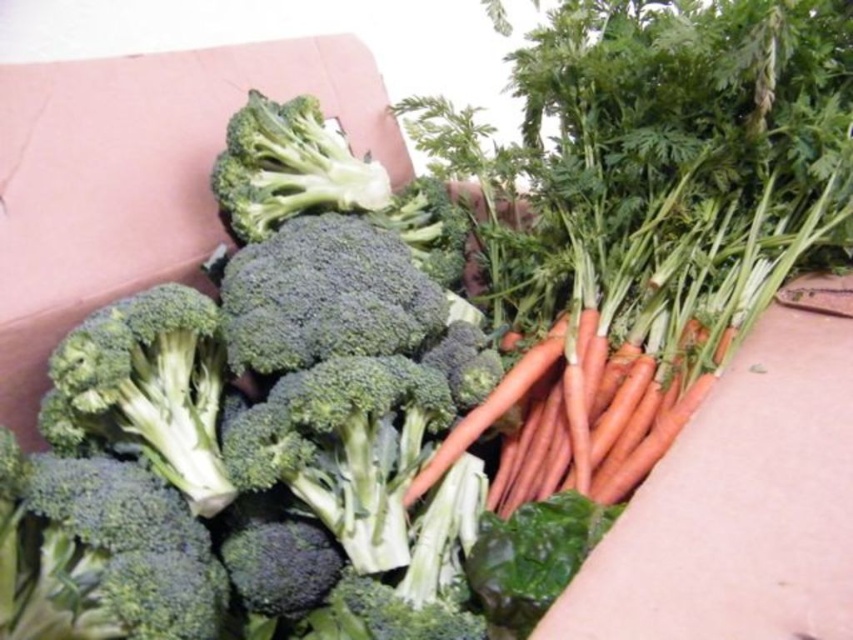
You are a chef preparing a vegetable platter and need to choose the bigger broccoli between the green matte broccoli at center and the green fresh broccoli at upper center. Which one should you pick?

The green matte broccoli at center is larger in size compared to the green fresh broccoli at upper center, so you should pick the green matte broccoli at center for your vegetable platter.

You are a grocery store employee who needs to stack boxes on a shelf. The shelf has limited vertical space. You have two broccoli items to place there. The first is the green matte broccoli at center and the second is the green fresh broccoli at upper center. Which broccoli item should you choose to fit better in the limited vertical space?

The green fresh broccoli at upper center is shorter than the green matte broccoli at center, so it would fit better in the limited vertical space.

You are a chef preparing a vegetable platter and need to know the distance between the green matte broccoli at center and the green matte broccoli at left. Can you tell me how far apart they are?

The green matte broccoli at center and green matte broccoli at left are 3.86 inches apart.